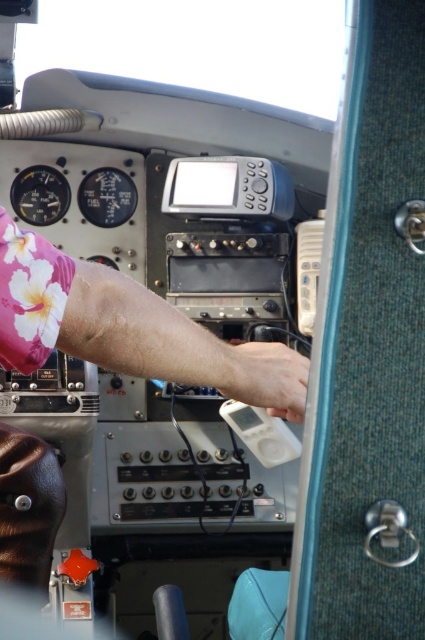
You are a pilot preparing for takeoff and notice the pink floral fabric at center and the white matte hand at center in the cockpit. Which object is closer to you as you sit in the cockpit seat?

The pink floral fabric at center is closer to you because it is in front of the white matte hand at center.

You are a pilot preparing for takeoff and notice a pink floral fabric at center on the aircraft cockpit control panel. According to aviation safety protocols, where should this item be placed before initiating the preflight checklist?

The pink floral fabric at center should be removed from the control panel as it is not part of the aircraft instrumentation and could interfere with critical flight operations. All loose items must be secured in designated storage areas before flight.

Consider the image. You are a pilot preparing for takeoff and notice a pink floral fabric at center. What is located at the coordinates point (127,328) in the cockpit?

The point (127,328) indicates the location of the pink floral fabric at center.